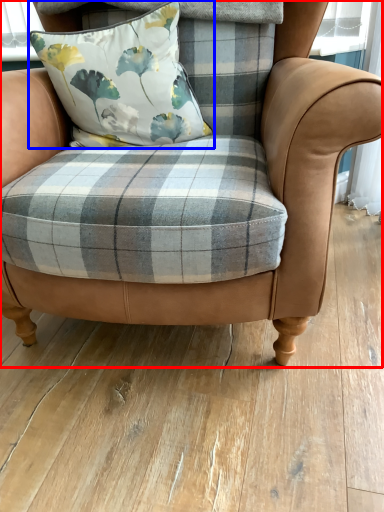
Question: Which object is closer to the camera taking this photo, chair (highlighted by a red box) or pillow (highlighted by a blue box)?

Choices:
 (A) chair
 (B) pillow

Answer: (A)